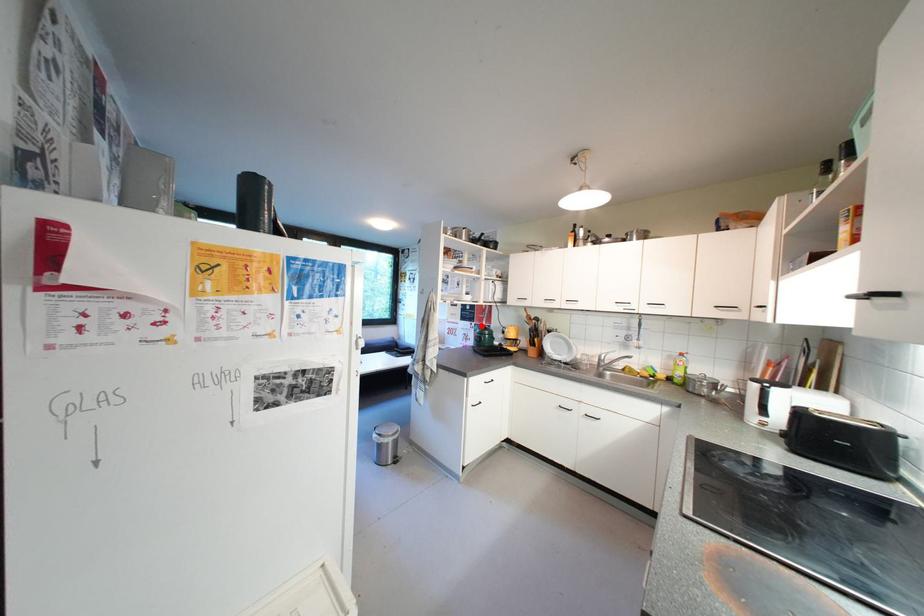
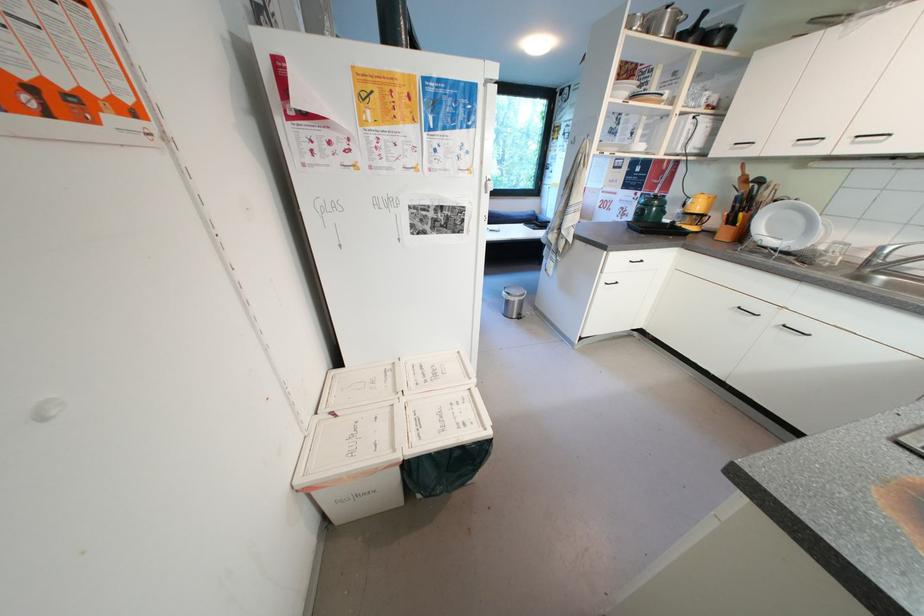
Where in the second image is the point corresponding to the highlighted location from the first image?

(647, 196)